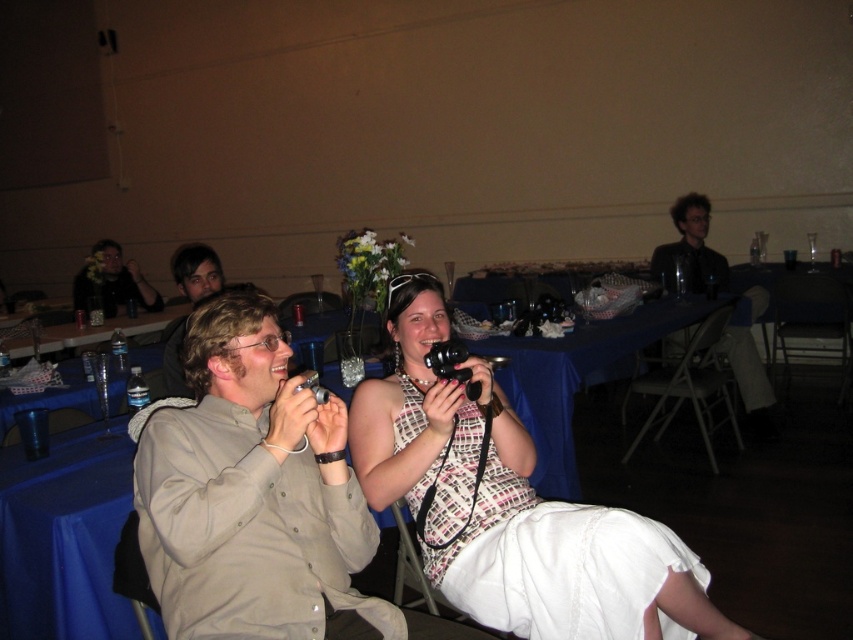
Who is more distant from viewer, (410, 508) or (521, 362)?

The point (521, 362) is behind.

Is beige fabric shirt at center above blue fabric table at center?

No.

Who is more distant from viewer, (412, 317) or (581, 369)?

The point (581, 369) is behind.

Where is `beige fabric shirt at center`? This screenshot has width=853, height=640. beige fabric shirt at center is located at coordinates (509, 506).

Looking at this image, is the position of blue fabric table at center less distant than that of light brown hair at center?

No, blue fabric table at center is behind light brown hair at center.

Is blue fabric table at center smaller than light brown hair at center?

No, blue fabric table at center is not smaller than light brown hair at center.

Who is more forward, (544, 426) or (173, 339)?

Point (173, 339) is more forward.

You are a GUI agent. You are given a task and a screenshot of the screen. Output one action in this format:
    pyautogui.click(x=<x>, y=<y>)
    Task: Click on the blue fabric table at center
    Image resolution: width=853 pixels, height=640 pixels.
    Given the screenshot: What is the action you would take?
    pyautogui.click(x=579, y=374)

This screenshot has width=853, height=640. What do you see at coordinates (579, 374) in the screenshot?
I see `blue fabric table at center` at bounding box center [579, 374].

Is blue fabric table at center below clear plastic water bottles at left?

No.

Is point (646, 307) positioned before point (68, 342)?

Yes, point (646, 307) is in front of point (68, 342).

Identify the location of blue fabric table at center. (579, 374).